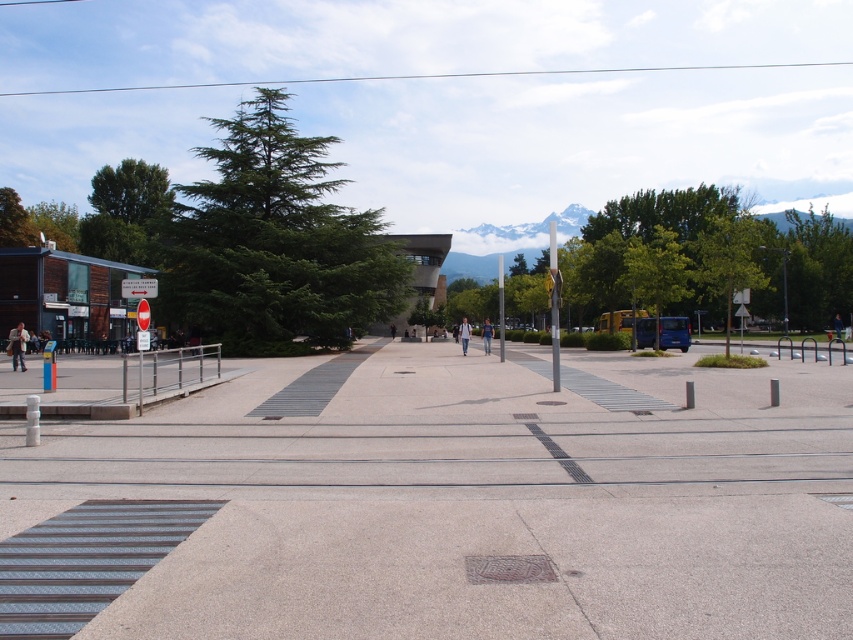
Can you confirm if gray concrete pavement at center is positioned to the right of light blue jeans at center?

In fact, gray concrete pavement at center is to the left of light blue jeans at center.

Between gray concrete pavement at center and light blue jeans at center, which one is positioned lower?

Positioned lower is gray concrete pavement at center.

The image size is (853, 640). I want to click on gray concrete pavement at center, so click(460, 499).

Can you confirm if gray concrete pavement at center is shorter than denim jeans at center?

Yes.

Which is more to the right, gray concrete pavement at center or denim jeans at center?

denim jeans at center

Identify the location of gray concrete pavement at center. The width and height of the screenshot is (853, 640). (460, 499).

The image size is (853, 640). I want to click on gray concrete pavement at center, so click(x=460, y=499).

Is gray concrete pavement at center below light brown leather jacket at left?

Indeed, gray concrete pavement at center is positioned under light brown leather jacket at left.

Is gray concrete pavement at center bigger than light brown leather jacket at left?

Indeed, gray concrete pavement at center has a larger size compared to light brown leather jacket at left.

Who is more distant from viewer, (669, 584) or (15, 365)?

The point (15, 365) is behind.

You are a GUI agent. You are given a task and a screenshot of the screen. Output one action in this format:
    pyautogui.click(x=<x>, y=<y>)
    Task: Click on the gray concrete pavement at center
    The image size is (853, 640).
    Given the screenshot: What is the action you would take?
    pyautogui.click(x=460, y=499)